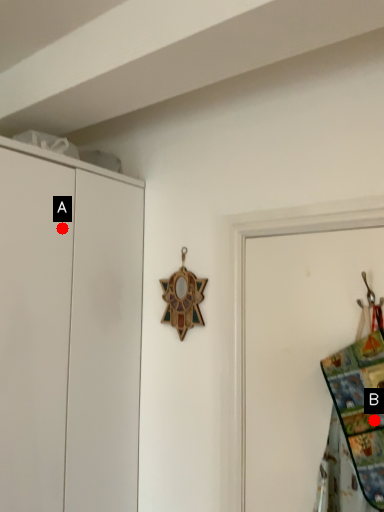
Question: Two points are circled on the image, labeled by A and B beside each circle. Which point is closer to the camera?

Choices:
 (A) A is closer
 (B) B is closer

Answer: (B)